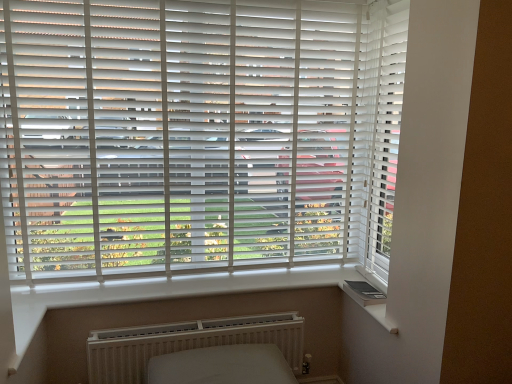
What do you see at coordinates (188, 343) in the screenshot? Image resolution: width=512 pixels, height=384 pixels. I see `white textured radiator at lower center` at bounding box center [188, 343].

Identify the location of white smooth window sill at lower right. The height and width of the screenshot is (384, 512). (371, 308).

Considering the relative sizes of white matte blinds at center and white smooth window sill at lower right in the image provided, is white matte blinds at center taller than white smooth window sill at lower right?

Indeed, white matte blinds at center has a greater height compared to white smooth window sill at lower right.

Does white matte blinds at center touch white smooth window sill at lower right?

No, white matte blinds at center is not beside white smooth window sill at lower right.

From the image's perspective, between white matte blinds at center and white smooth window sill at lower right, who is located below?

From the image's view, white smooth window sill at lower right is below.

Is white matte blinds at center situated inside white smooth window sill at lower right or outside?

white matte blinds at center is outside white smooth window sill at lower right.

In the scene shown: Between white smooth window sill at lower right and white textured radiator at lower center, which one has larger size?

white textured radiator at lower center.

Is white smooth window sill at lower right positioned beyond the bounds of white textured radiator at lower center?

Yes, white smooth window sill at lower right is located beyond the bounds of white textured radiator at lower center.

From the image's perspective, which is below, white smooth window sill at lower right or white textured radiator at lower center?

white textured radiator at lower center.

From the picture: Which object is further away from the camera taking this photo, white smooth window sill at lower right or white textured radiator at lower center?

Positioned behind is white textured radiator at lower center.

Based on the photo, can you tell me how much white textured radiator at lower center and white smooth window sill at lower right differ in facing direction?

They differ by 0.0639 degrees in their facing directions.

Looking at the image, does white textured radiator at lower center seem bigger or smaller compared to white smooth window sill at lower right?

In the image, white textured radiator at lower center appears to be larger than white smooth window sill at lower right.

Which is correct: white textured radiator at lower center is inside white smooth window sill at lower right, or outside of it?

The correct answer is: outside.

Consider the image. Which object is positioned more to the right, white smooth window sill at lower right or white matte blinds at center?

From the viewer's perspective, white smooth window sill at lower right appears more on the right side.

Considering the points (362, 297) and (99, 142), which point is in front, point (362, 297) or point (99, 142)?

The point (99, 142) is closer.

Between white smooth window sill at lower right and white matte blinds at center, which one has less height?

white smooth window sill at lower right is shorter.

From the image's perspective, is white smooth window sill at lower right positioned above or below white matte blinds at center?

Based on their image positions, white smooth window sill at lower right is located beneath white matte blinds at center.

From a real-world perspective, is white textured radiator at lower center on white matte blinds at center?

No.

Is white textured radiator at lower center positioned before white matte blinds at center?

No, white textured radiator at lower center is further to the viewer.

Is white matte blinds at center inside white textured radiator at lower center?

No, white matte blinds at center is located outside of white textured radiator at lower center.

From a real-world perspective, is white matte blinds at center over white textured radiator at lower center?

Yes, from a real-world perspective, white matte blinds at center is over white textured radiator at lower center

The height and width of the screenshot is (384, 512). In order to click on radiator below the white matte blinds at center (from a real-world perspective) in this screenshot , I will do `click(188, 343)`.

Consider the image. Between white matte blinds at center and white textured radiator at lower center, which one has smaller size?

white textured radiator at lower center is smaller.

Is point (138, 169) closer or farther from the camera than point (221, 333)?

Point (138, 169) appears to be farther away from the viewer than point (221, 333).

Where is `window sill located underneath the white matte blinds at center (from a real-world perspective)`? The height and width of the screenshot is (384, 512). window sill located underneath the white matte blinds at center (from a real-world perspective) is located at coordinates pos(371,308).

The height and width of the screenshot is (384, 512). I want to click on window sill above the white textured radiator at lower center (from the image's perspective), so click(371, 308).

Looking at the image, which one is located further to white textured radiator at lower center, white matte blinds at center or white smooth window sill at lower right?

white matte blinds at center.

When comparing their distances from white matte blinds at center, does white smooth window sill at lower right or white textured radiator at lower center seem closer?

Among the two, white textured radiator at lower center is located nearer to white matte blinds at center.

Based on their spatial positions, is white matte blinds at center or white textured radiator at lower center further from white smooth window sill at lower right?

white matte blinds at center is positioned further to the anchor white smooth window sill at lower right.

When comparing their distances from white textured radiator at lower center, does white smooth window sill at lower right or white matte blinds at center seem further?

Among the two, white matte blinds at center is located further to white textured radiator at lower center.

From the image, which object appears to be nearer to white matte blinds at center, white textured radiator at lower center or white smooth window sill at lower right?

white textured radiator at lower center is closer to white matte blinds at center.

When comparing their distances from white smooth window sill at lower right, does white textured radiator at lower center or white matte blinds at center seem further?

Among the two, white matte blinds at center is located further to white smooth window sill at lower right.

I want to click on window sill between white matte blinds at center and white textured radiator at lower center in the vertical direction, so click(371, 308).